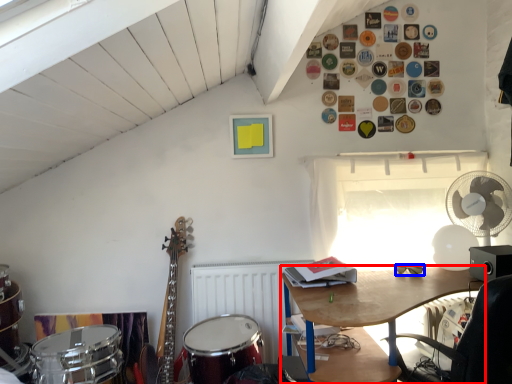
Question: Which point is further to the camera, desk (highlighted by a red box) or glasses (highlighted by a blue box)?

Choices:
 (A) desk
 (B) glasses

Answer: (B)